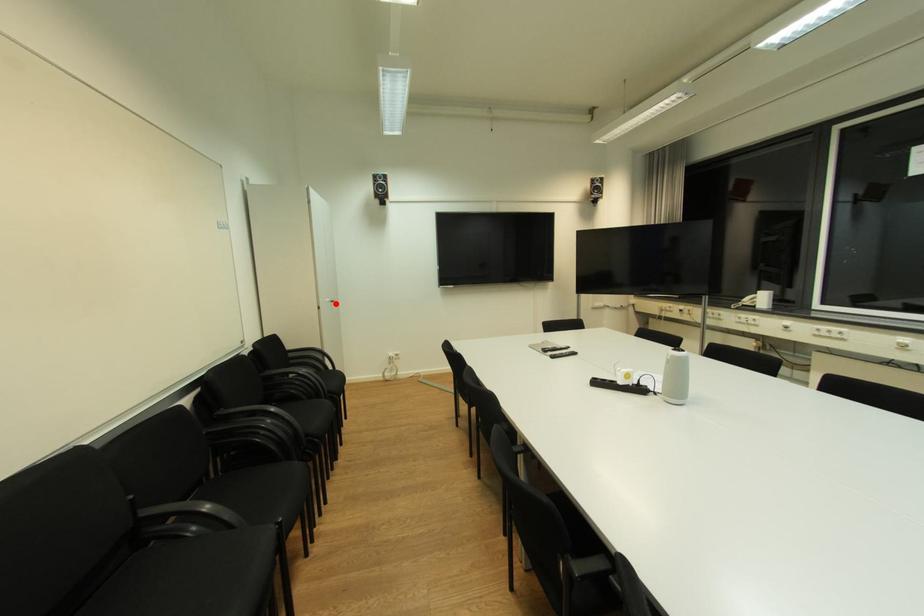
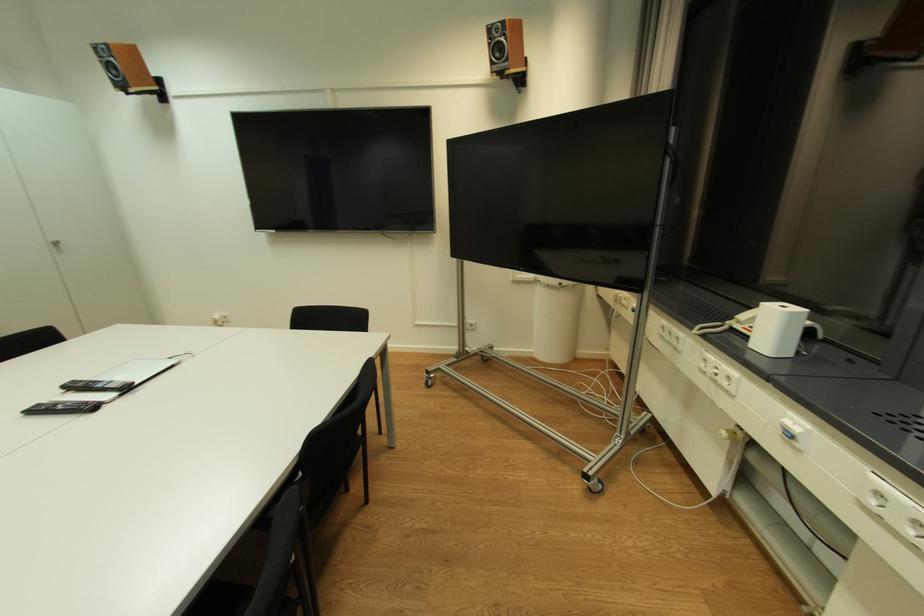
The point at the highlighted location is marked in the first image. Where is the corresponding point in the second image?

(57, 246)